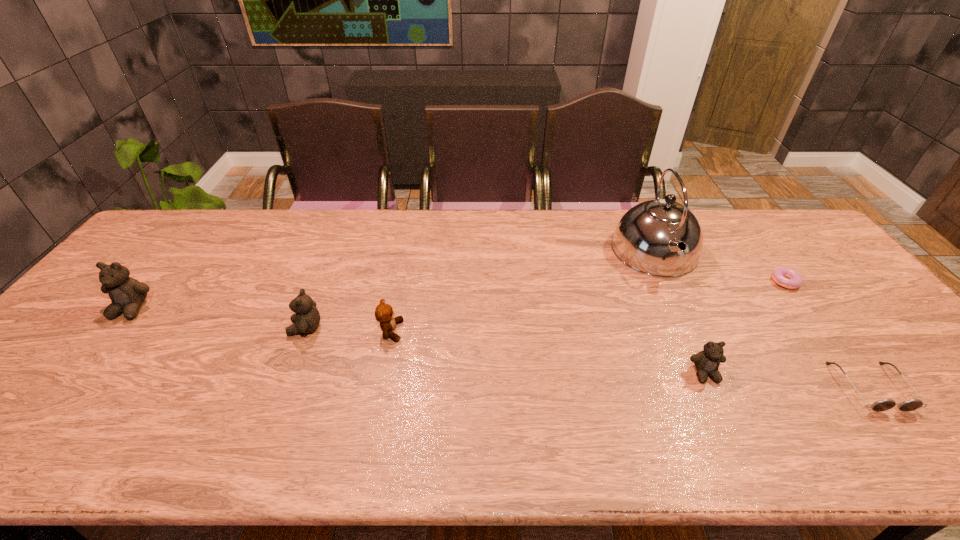
Find the location of a particular element. The width and height of the screenshot is (960, 540). doughnut that is at the right edge is located at coordinates pos(785,277).

You are a GUI agent. You are given a task and a screenshot of the screen. Output one action in this format:
    pyautogui.click(x=<x>, y=<y>)
    Task: Click on the sunglasses positioned at the right edge
    This screenshot has width=960, height=540.
    Given the screenshot: What is the action you would take?
    pyautogui.click(x=882, y=405)

In order to click on object positioned at the near right corner in this screenshot , I will do `click(882, 405)`.

Identify the location of blank space at the far edge. The height and width of the screenshot is (540, 960). (307, 246).

What are the coordinates of `vacant space at the near edge of the desktop` in the screenshot? It's located at click(469, 388).

Where is `free region at the left edge of the desktop`? The height and width of the screenshot is (540, 960). free region at the left edge of the desktop is located at coordinates (56, 360).

I want to click on vacant space at the far left corner of the desktop, so click(195, 235).

The width and height of the screenshot is (960, 540). In the image, there is a desktop. Identify the location of vacant region at the far right corner. (787, 217).

The width and height of the screenshot is (960, 540). I want to click on vacant area that lies between the doughnut and the third teddy bear from left to right, so click(x=588, y=306).

The width and height of the screenshot is (960, 540). I want to click on unoccupied area between the third object from left to right and the second tallest teddy bear, so click(348, 330).